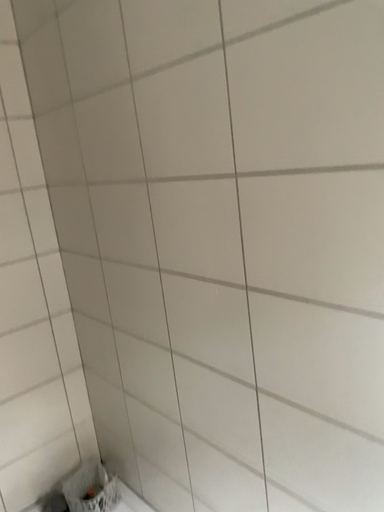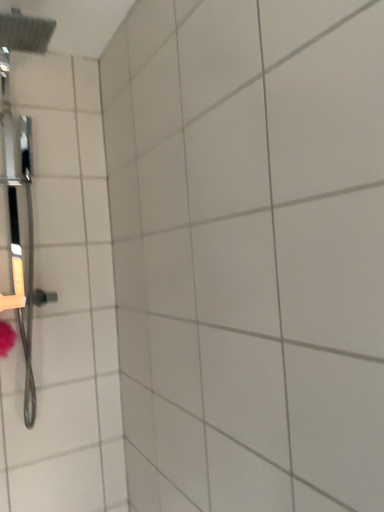
Question: How did the camera likely rotate when shooting the video?

Choices:
 (A) rotated downward
 (B) rotated upward

Answer: (B)